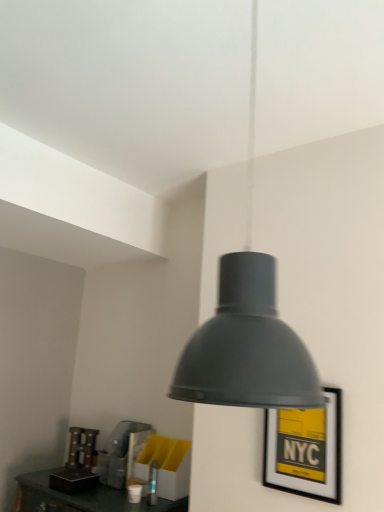
Question: Can you confirm if yellow matte picture frame at center-right is bigger than matte black lampshade at center?

Choices:
 (A) yes
 (B) no

Answer: (B)

Question: Does yellow matte picture frame at center-right have a smaller size compared to matte black lampshade at center?

Choices:
 (A) no
 (B) yes

Answer: (B)

Question: From a real-world perspective, does yellow matte picture frame at center-right stand above matte black lampshade at center?

Choices:
 (A) no
 (B) yes

Answer: (A)

Question: Considering the relative sizes of yellow matte picture frame at center-right and matte black lampshade at center in the image provided, is yellow matte picture frame at center-right wider than matte black lampshade at center?

Choices:
 (A) no
 (B) yes

Answer: (A)

Question: Is yellow matte picture frame at center-right positioned with its back to matte black lampshade at center?

Choices:
 (A) no
 (B) yes

Answer: (A)

Question: Is yellow matte picture frame at center-right outside of matte black lampshade at center?

Choices:
 (A) no
 (B) yes

Answer: (B)

Question: Considering the relative sizes of matte black lampshade at center and yellow matte picture frame at center-right in the image provided, is matte black lampshade at center smaller than yellow matte picture frame at center-right?

Choices:
 (A) no
 (B) yes

Answer: (A)

Question: From the image's perspective, is matte black lampshade at center below yellow matte picture frame at center-right?

Choices:
 (A) no
 (B) yes

Answer: (A)

Question: Is matte black lampshade at center looking in the opposite direction of yellow matte picture frame at center-right?

Choices:
 (A) yes
 (B) no

Answer: (B)

Question: Can you confirm if matte black lampshade at center is positioned to the left of yellow matte picture frame at center-right?

Choices:
 (A) yes
 (B) no

Answer: (A)

Question: Does matte black lampshade at center contain yellow matte picture frame at center-right?

Choices:
 (A) no
 (B) yes

Answer: (A)

Question: Does matte black lampshade at center have a larger size compared to yellow matte picture frame at center-right?

Choices:
 (A) no
 (B) yes

Answer: (B)

Question: Which is correct: yellow matte picture frame at center-right is inside matte black lampshade at center, or outside of it?

Choices:
 (A) outside
 (B) inside

Answer: (A)